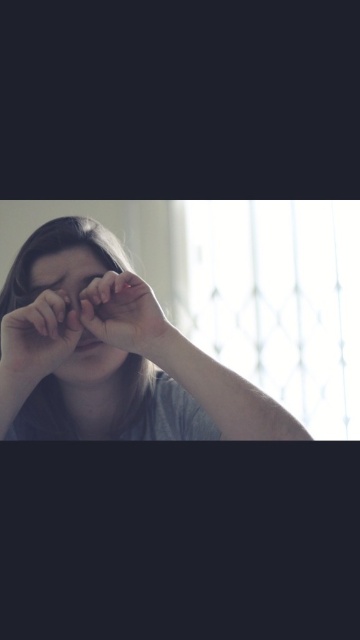
Looking at this image, you are a photographer adjusting lighting for a portrait. You notice the matte black hand at lower left and the matte skin hand at center in the frame. Which hand appears smaller in the photo?

The matte black hand at lower left has a lesser width compared to the matte skin hand at center, so it appears smaller in the photo.

You are taking a photo and want to ensure the matte gray shirt at center is in focus. Given that the camera focuses on the area at point coordinates 0.553, 0.308, will the shirt be sharp in the photo?

The matte gray shirt at center is located at point (110, 353), so yes, the camera focusing on that exact coordinate will ensure the shirt is sharp in the photo.